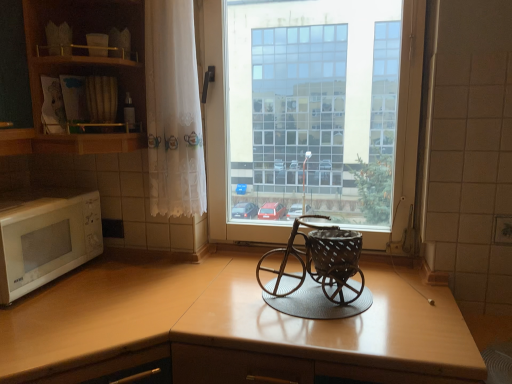
The image size is (512, 384). Find the location of `free region under wooden cabinet at upper left (from a real-world perspective)`. free region under wooden cabinet at upper left (from a real-world perspective) is located at coordinates (123, 266).